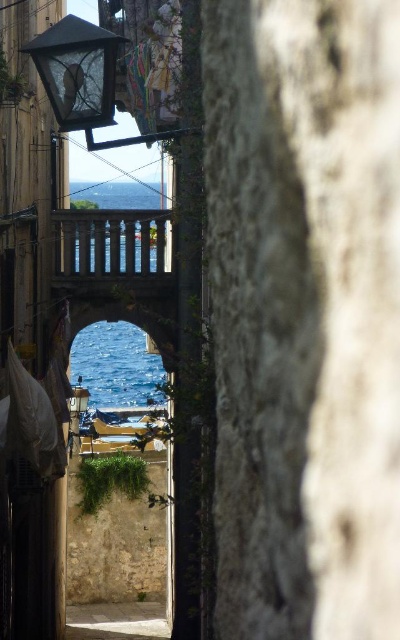
Question: Considering the relative positions of stone balustrade at center and blue water at center in the image provided, where is stone balustrade at center located with respect to blue water at center?

Choices:
 (A) above
 (B) below

Answer: (A)

Question: Does matte glass lamp at upper left lie in front of matte glass lamp at center?

Choices:
 (A) yes
 (B) no

Answer: (A)

Question: Is matte glass lamp at upper left wider than blue water at center?

Choices:
 (A) yes
 (B) no

Answer: (B)

Question: Which of these objects is positioned closest to the stone balustrade at center?

Choices:
 (A) blue water at center
 (B) matte glass lamp at center
 (C) blue glass water at upper center

Answer: (B)

Question: Which point appears farthest from the camera in this image?

Choices:
 (A) (132, 358)
 (B) (50, 92)
 (C) (75, 406)

Answer: (A)

Question: Which of the following is the farthest from the observer?

Choices:
 (A) matte glass lamp at upper left
 (B) stone balustrade at center
 (C) matte glass lamp at center
 (D) blue glass water at upper center

Answer: (D)